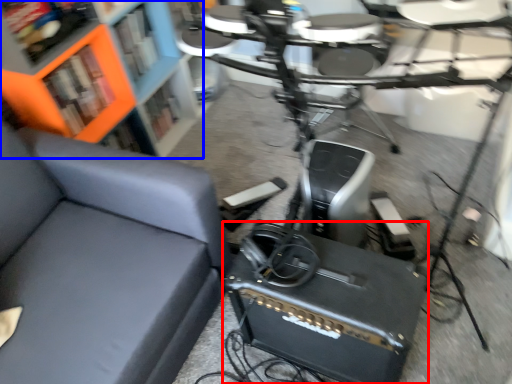
Question: Among these objects, which one is farthest to the camera, speaker (highlighted by a red box) or bookcase (highlighted by a blue box)?

Choices:
 (A) speaker
 (B) bookcase

Answer: (B)